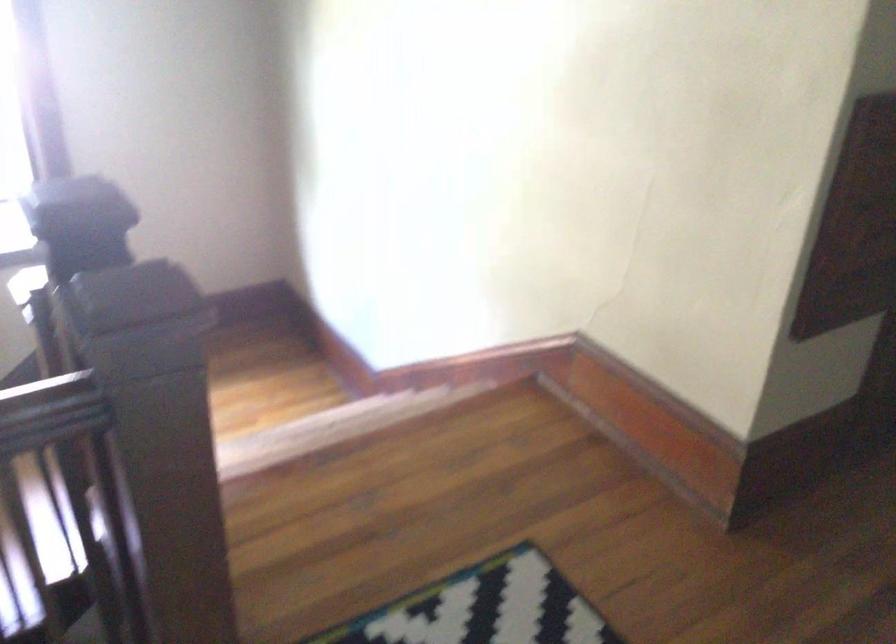
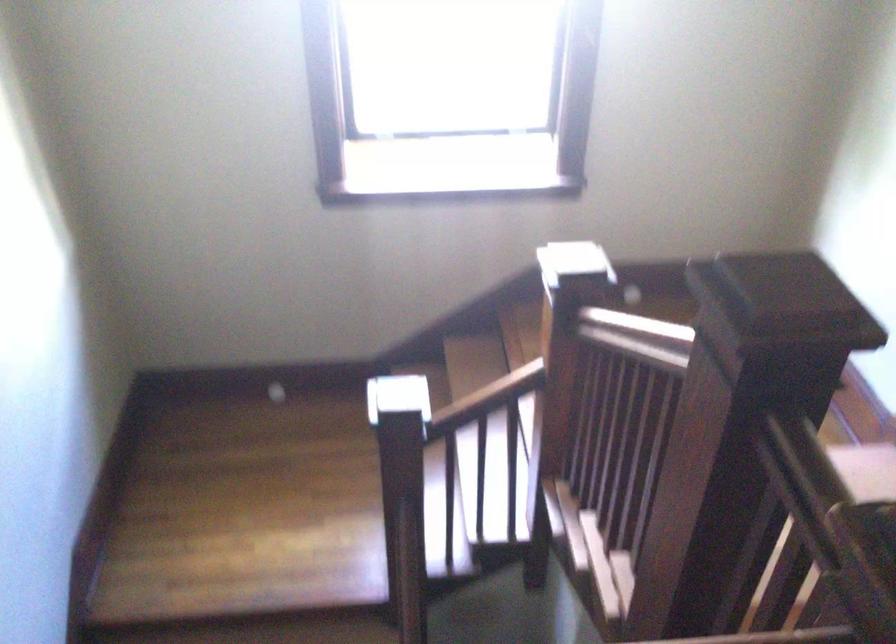
Question: How did the camera likely rotate?

Choices:
 (A) Left
 (B) Right
 (C) Up
 (D) Down

Answer: (A)